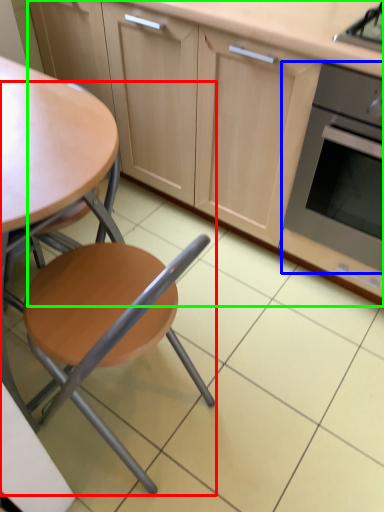
Question: Estimate the real-world distances between objects in this image. Which object is closer to chair (highlighted by a red box), kitchen appliance (highlighted by a blue box) or cabinetry (highlighted by a green box)?

Choices:
 (A) kitchen appliance
 (B) cabinetry

Answer: (A)